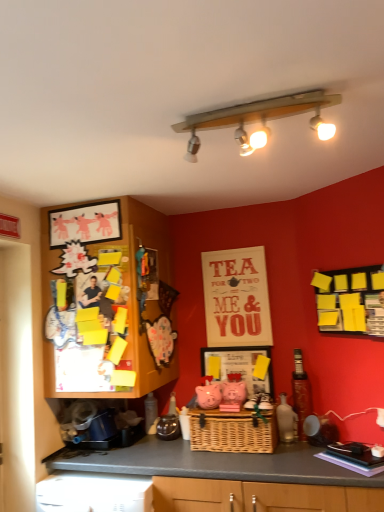
The width and height of the screenshot is (384, 512). In order to click on free space above yellow sticky notes at upper right (from a real-world perspective) in this screenshot , I will do `click(342, 261)`.